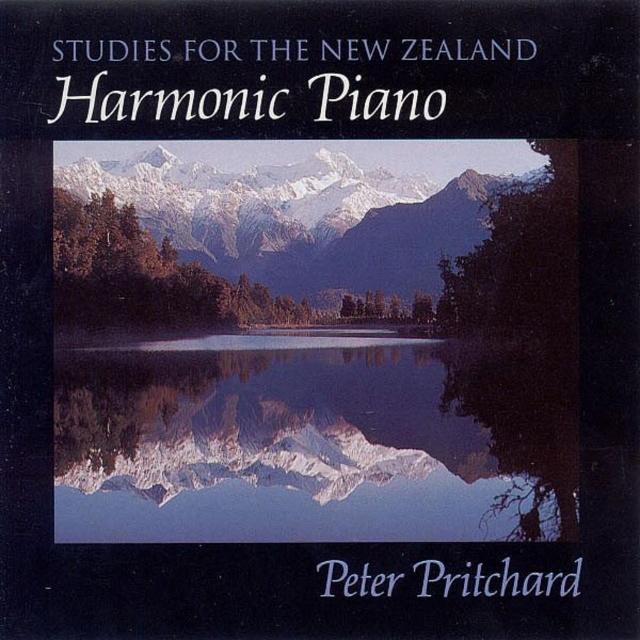
Based on the album cover description, if you were to look at the transparent glass water at center and the snowy gray mountain range at center, which object would you see first from the observer perspective?

The snowy gray mountain range at center would be seen first because it is positioned above the transparent glass water at center, making it closer to the observer.

You are a graphic designer working on an album cover for a piano piece. The album cover has a central transparent glass water at center located at point (314, 442). If you want to place a small piano icon on the album cover such that it is positioned exactly 0.1 units to the right of the transparent glass water at center, what would be the coordinate of the piano icon?

The transparent glass water at center is located at point (314, 442). To position the piano icon 0.1 units to the right, add 0.1 to the x coordinate. The new coordinate would be 0.791, 0.492.

You are standing at the edge of the lake in the album cover image. You see two points marked on the image. One is at coordinate point (472, 531) and the other is at point (224, 176). Which point is closer to you?

Point (472, 531) is closer to the viewer than point (224, 176).